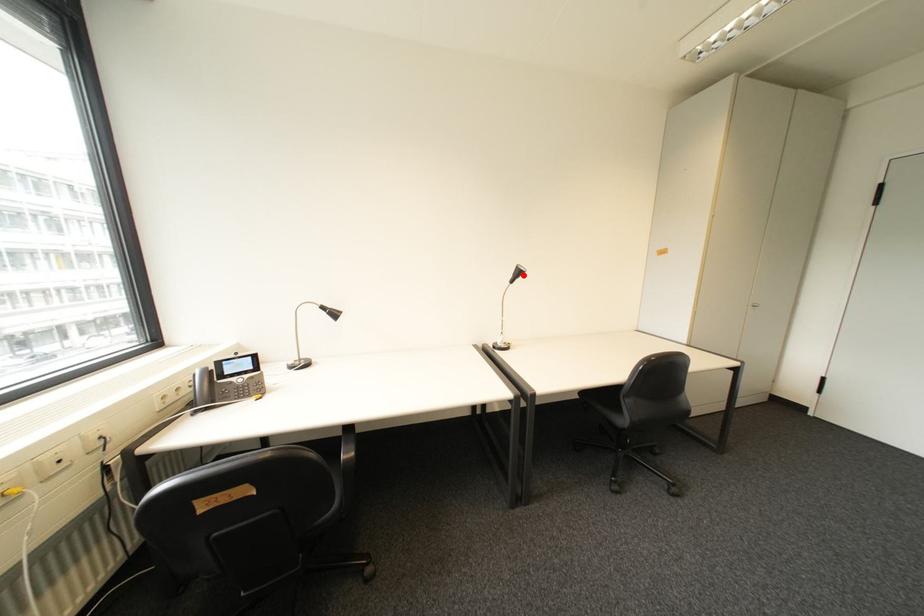
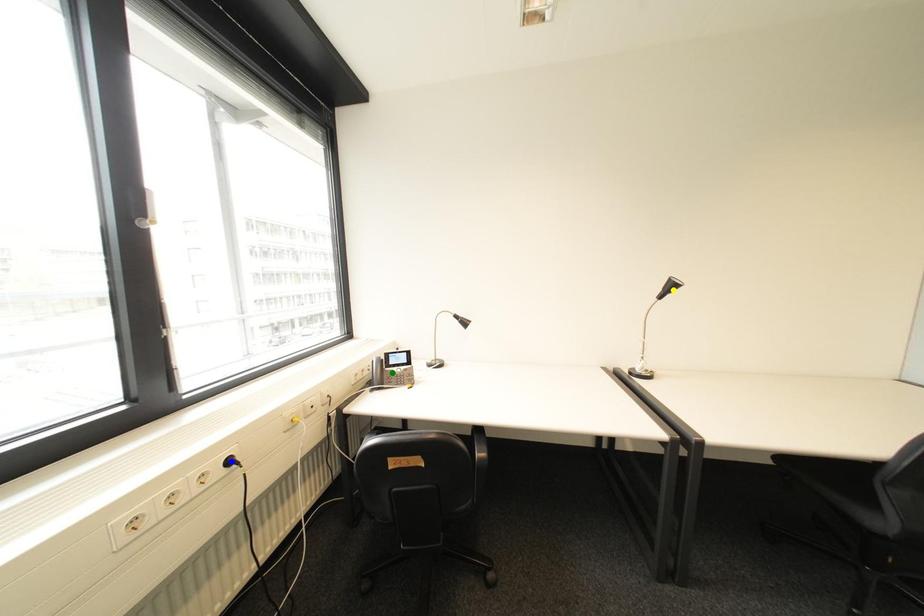
Question: I am providing you with two images of the same scene from different viewpoints. A red point is marked on the first image. You are given multiple points on the second image. In image 2, which mark is for the same physical point as the one in image 1?

Choices:
 (A) blue point
 (B) yellow point
 (C) green point

Answer: (B)